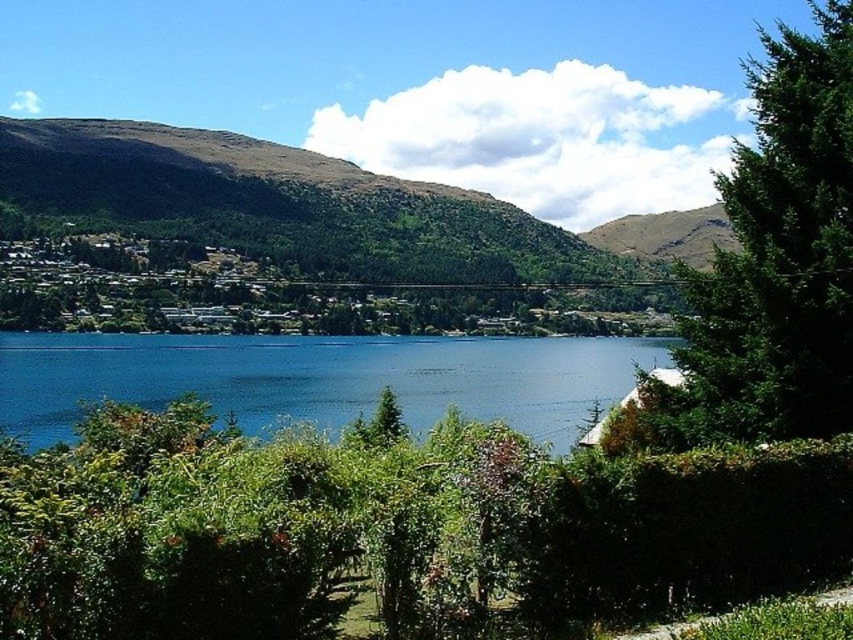
Question: Among these points, which one is nearest to the camera?

Choices:
 (A) (778, 211)
 (B) (544, 376)

Answer: (A)

Question: Can you confirm if green leafy tree at right is positioned below blue water at center?

Choices:
 (A) yes
 (B) no

Answer: (B)

Question: Which point appears closest to the camera in this image?

Choices:
 (A) [x=741, y=278]
 (B) [x=102, y=355]

Answer: (A)

Question: Which point appears closest to the camera in this image?

Choices:
 (A) (279, 371)
 (B) (799, 289)

Answer: (B)

Question: Observing the image, what is the correct spatial positioning of green leafy tree at right in reference to blue water at center?

Choices:
 (A) below
 (B) above

Answer: (B)

Question: Is green leafy tree at right closer to camera compared to blue water at center?

Choices:
 (A) yes
 (B) no

Answer: (A)